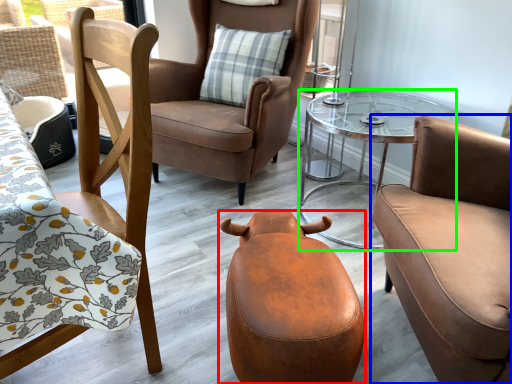
Question: Considering the real-world distances, which object is farthest from swivel chair (highlighted by a red box)? chair (highlighted by a blue box) or table (highlighted by a green box)?

Choices:
 (A) chair
 (B) table

Answer: (B)